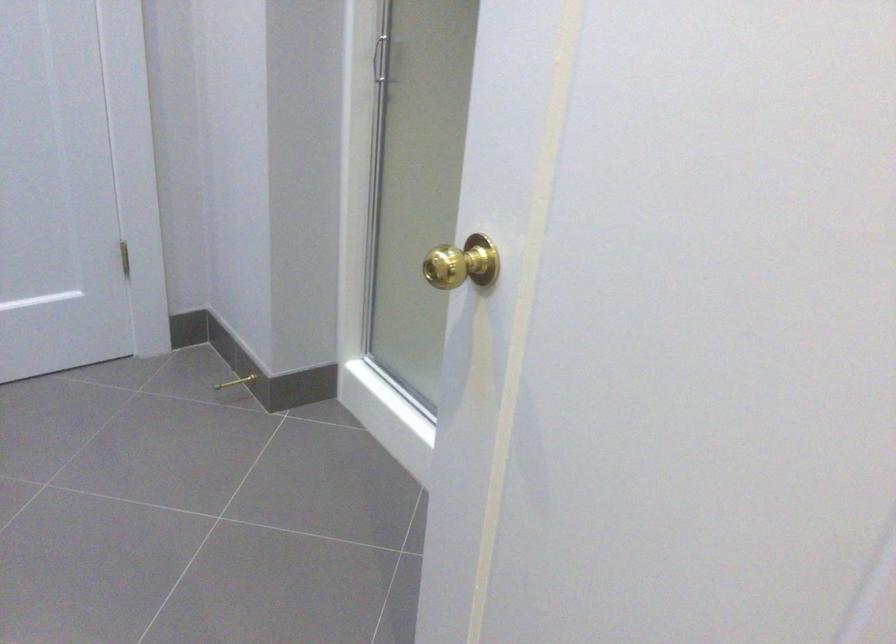
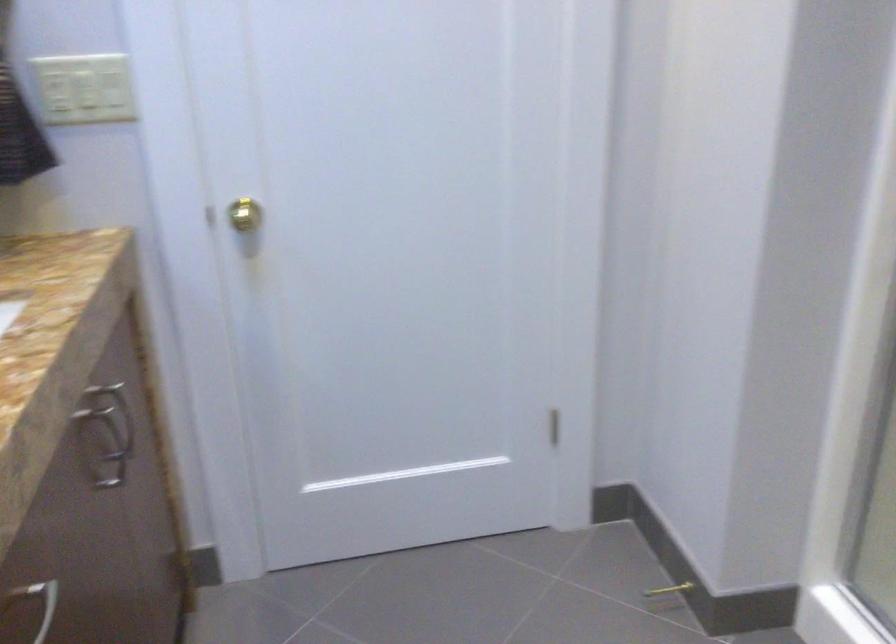
The point at (237,391) is marked in the first image. Where is the corresponding point in the second image?

(666, 596)